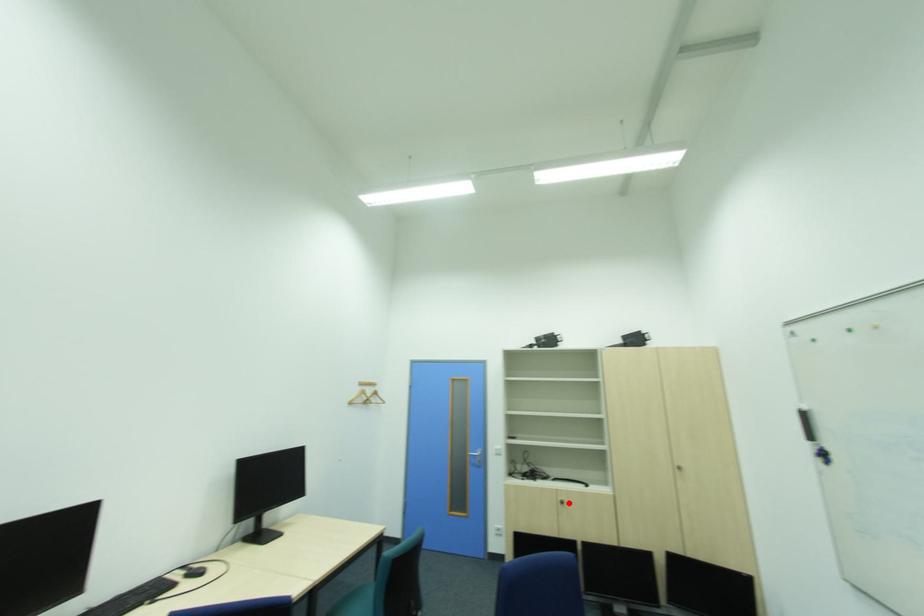
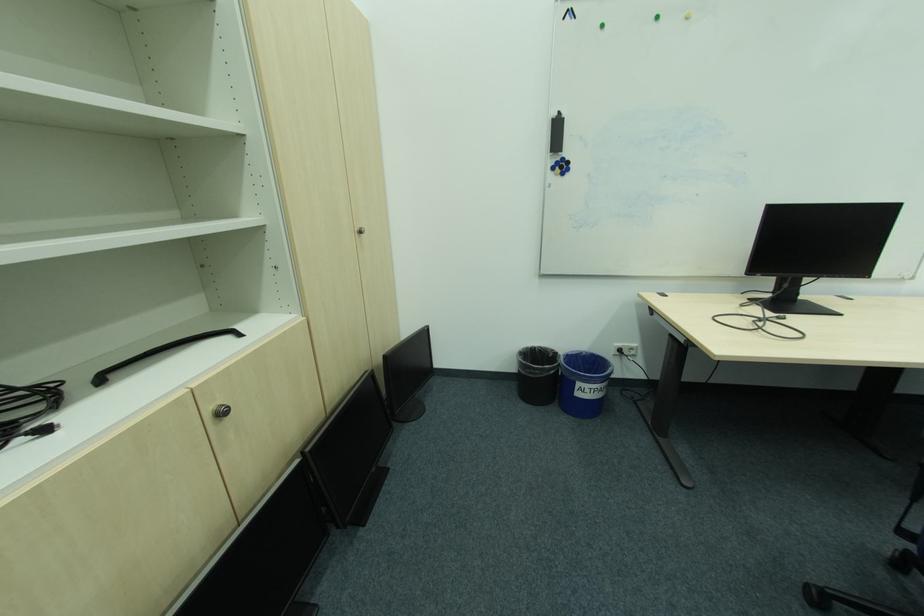
The point at the highlighted location is marked in the first image. Where is the corresponding point in the second image?

(227, 415)